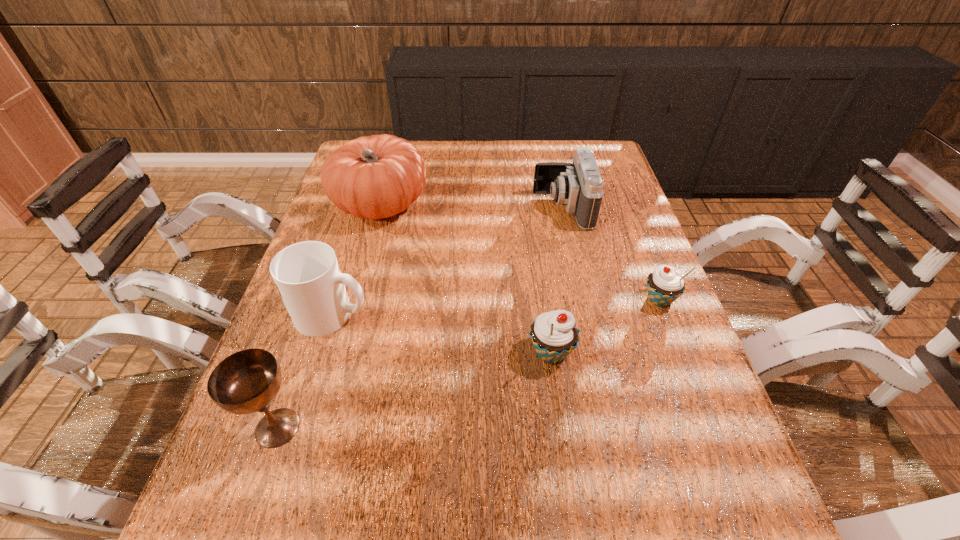
Find the location of `free spot located 0.330m at the front of the camera with an open lens cover`. free spot located 0.330m at the front of the camera with an open lens cover is located at coordinates point(422,207).

Locate an element on the screen. vacant space situated at the front of the camera with an open lens cover is located at coordinates (490, 207).

The image size is (960, 540). I want to click on vacant region located at the front of the camera with an open lens cover, so click(473, 207).

You are a GUI agent. You are given a task and a screenshot of the screen. Output one action in this format:
    pyautogui.click(x=<x>, y=<y>)
    Task: Click on the vacant space located on the handle side of the mug
    This screenshot has width=960, height=540.
    Given the screenshot: What is the action you would take?
    pyautogui.click(x=501, y=314)

At what (x,y) coordinates should I click in order to perform the action: click on vacant area located 0.340m on the right of the pumpkin. Please return your answer as a coordinate pair (x, y). The height and width of the screenshot is (540, 960). Looking at the image, I should click on (543, 205).

The image size is (960, 540). Find the location of `vacant space situated 0.050m on the right of the chalice`. vacant space situated 0.050m on the right of the chalice is located at coordinates (333, 428).

I want to click on object that is at the near edge, so click(x=247, y=381).

Where is `mug present at the left edge`? This screenshot has height=540, width=960. mug present at the left edge is located at coordinates coord(307,275).

Locate an element on the screen. This screenshot has height=540, width=960. pumpkin that is positioned at the left edge is located at coordinates (374, 177).

Where is `chalice that is positioned at the left edge`? This screenshot has height=540, width=960. chalice that is positioned at the left edge is located at coordinates (247, 381).